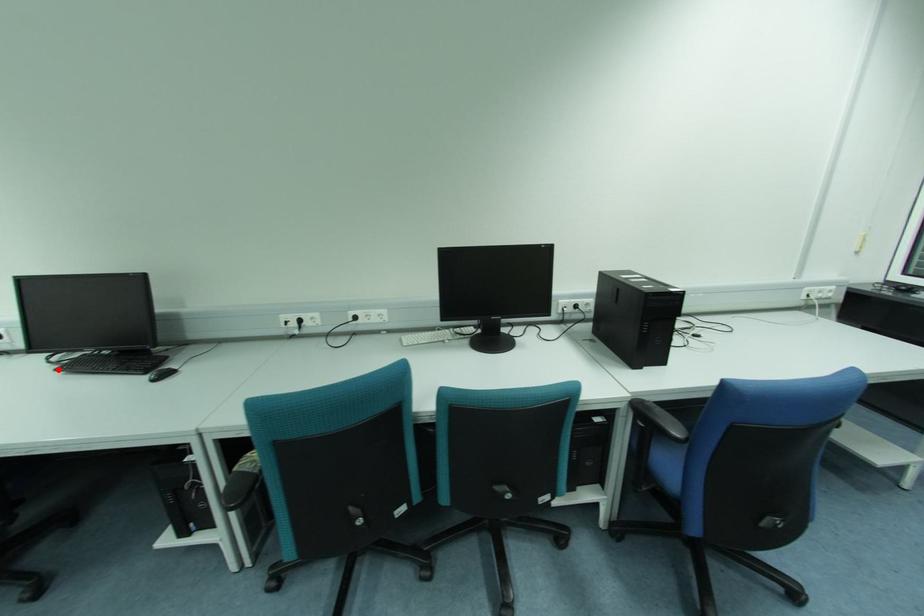
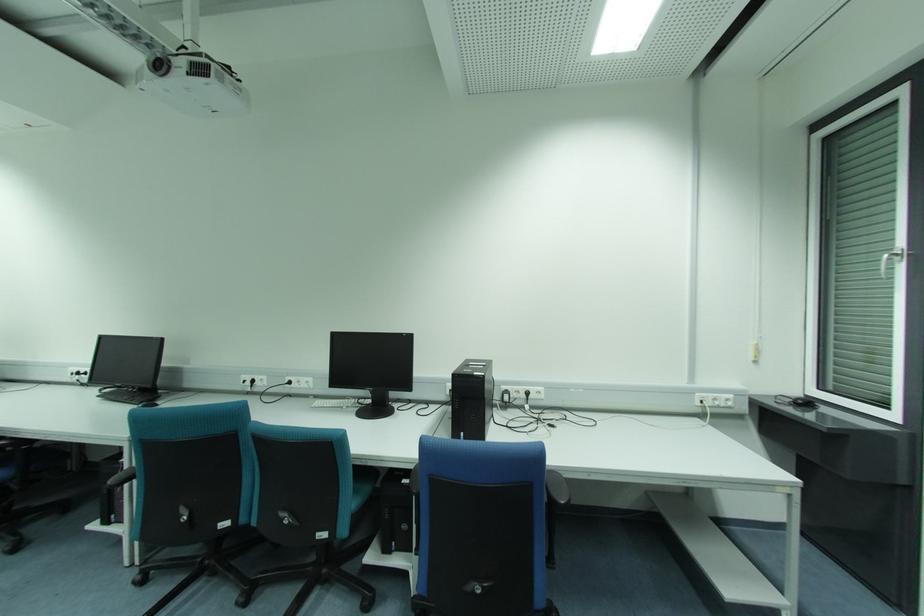
Question: I am providing you with two images of the same scene from different viewpoints. A red point is marked on the first image. Is the red point's position out of view in image 2?

Choices:
 (A) Yes
 (B) No

Answer: (B)